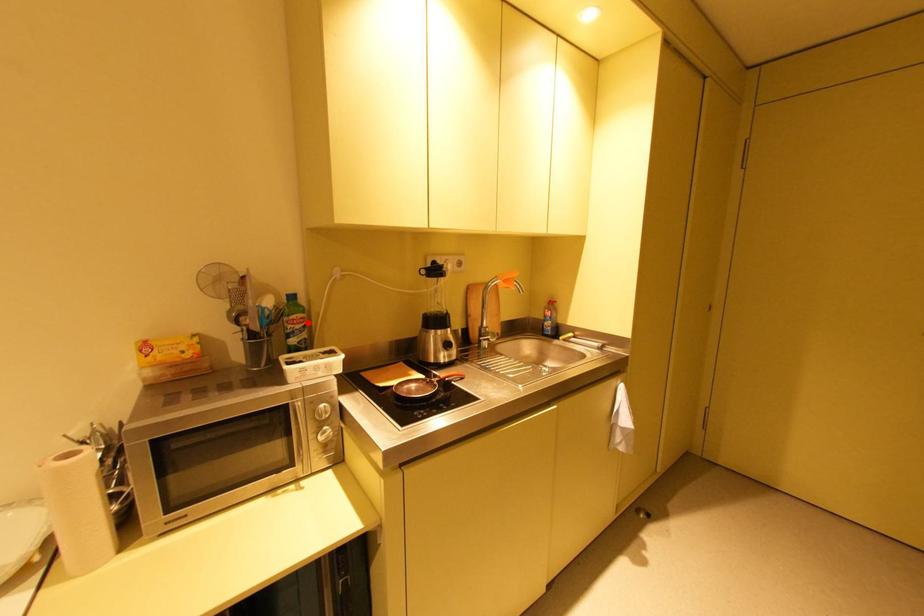
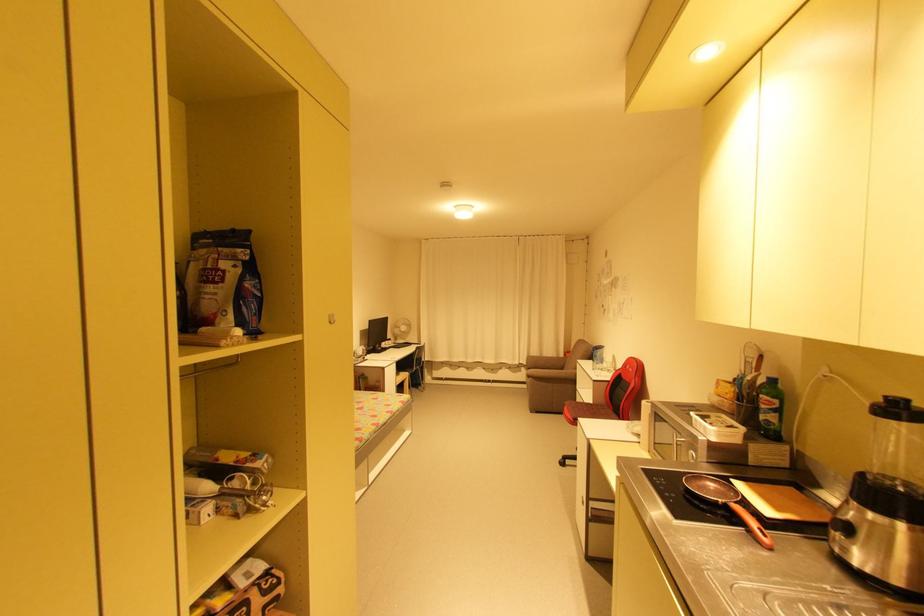
In the second image, find the point that corresponds to the highlighted location in the first image.

(773, 406)